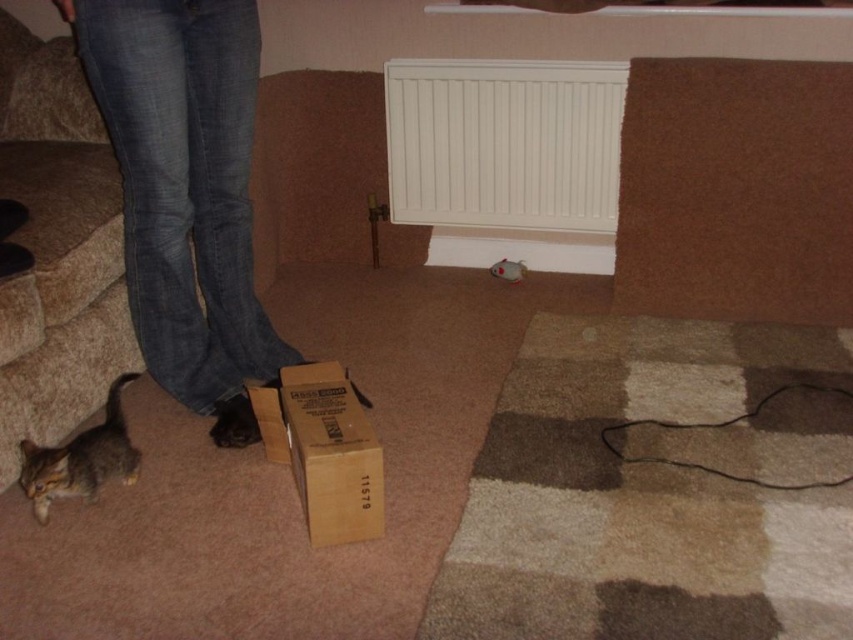
From the picture: You are trying to move a large piece of furniture through the doorway. The denim jeans at lower left and the white matte radiator at center are in the way. Which object should you move first to create more space?

You should move the denim jeans at lower left first because it has a lesser width compared to the white matte radiator at center, allowing for more space to maneuver the furniture.

You are a delivery person who needs to place a package on the floor without touching the denim jeans at lower left. Where should you place the package relative to the brown cardboard box at lower center?

The denim jeans at lower left is to the left of brown cardboard box at lower center, so you should place the package to the right of the brown cardboard box at lower center to avoid touching the denim jeans at lower left.